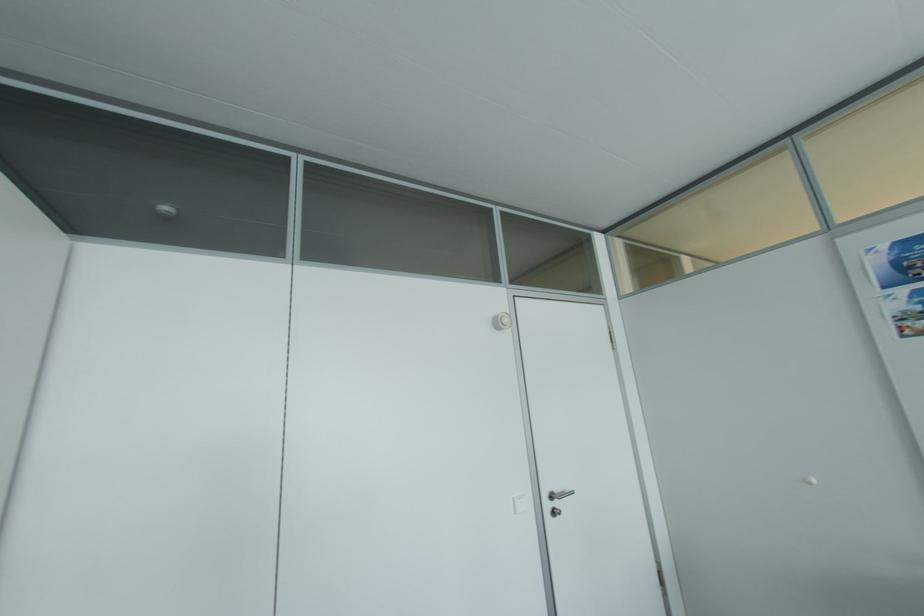
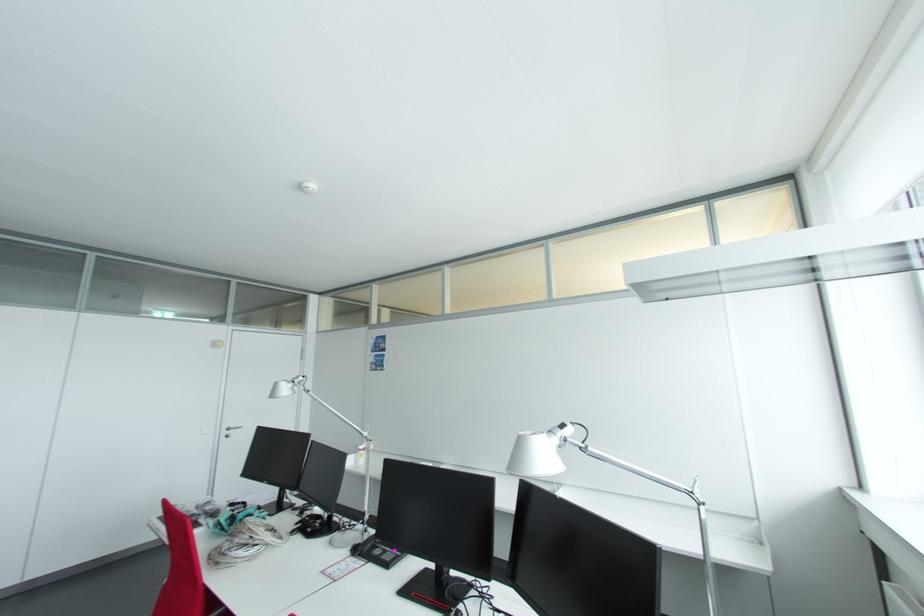
The point at (554, 496) is marked in the first image. Where is the corresponding point in the second image?

(232, 430)